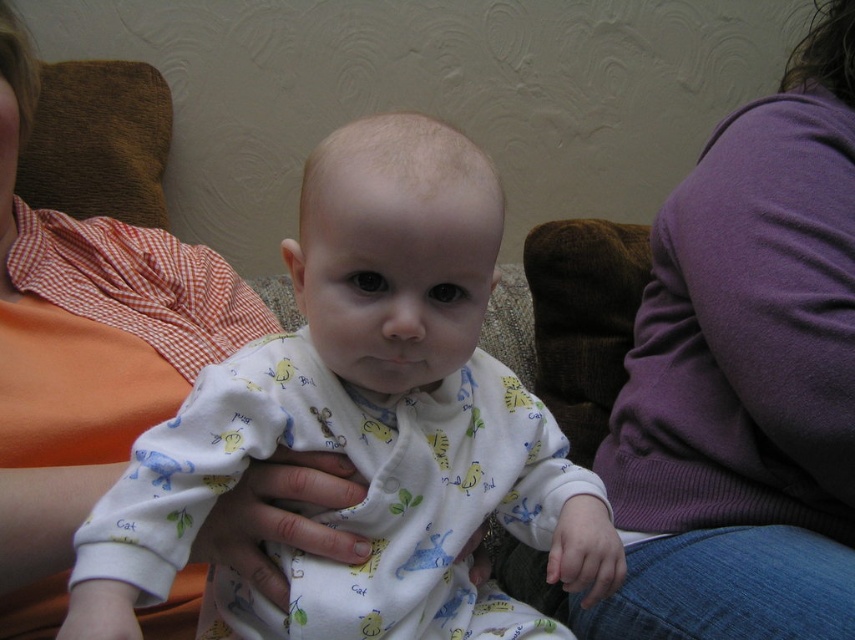
Is white cotton onesie at center positioned behind purple sweater at upper right?

No, it is not.

Who is more forward, (391, 353) or (705, 573)?

Point (391, 353) is in front.

Where is `white cotton onesie at center`? Image resolution: width=855 pixels, height=640 pixels. white cotton onesie at center is located at coordinates (364, 422).

Where is `white cotton onesie at center`? Image resolution: width=855 pixels, height=640 pixels. white cotton onesie at center is located at coordinates tap(364, 422).

Is purple sweater at upper right wider than orange cotton shirt at left?

Correct, the width of purple sweater at upper right exceeds that of orange cotton shirt at left.

I want to click on purple sweater at upper right, so click(x=746, y=378).

Image resolution: width=855 pixels, height=640 pixels. I want to click on purple sweater at upper right, so click(746, 378).

Does white cotton onesie at center appear over orange cotton shirt at left?

No.

Who is positioned more to the right, white cotton onesie at center or orange cotton shirt at left?

white cotton onesie at center is more to the right.

Describe the element at coordinates (364, 422) in the screenshot. The height and width of the screenshot is (640, 855). I see `white cotton onesie at center` at that location.

I want to click on white cotton onesie at center, so click(x=364, y=422).